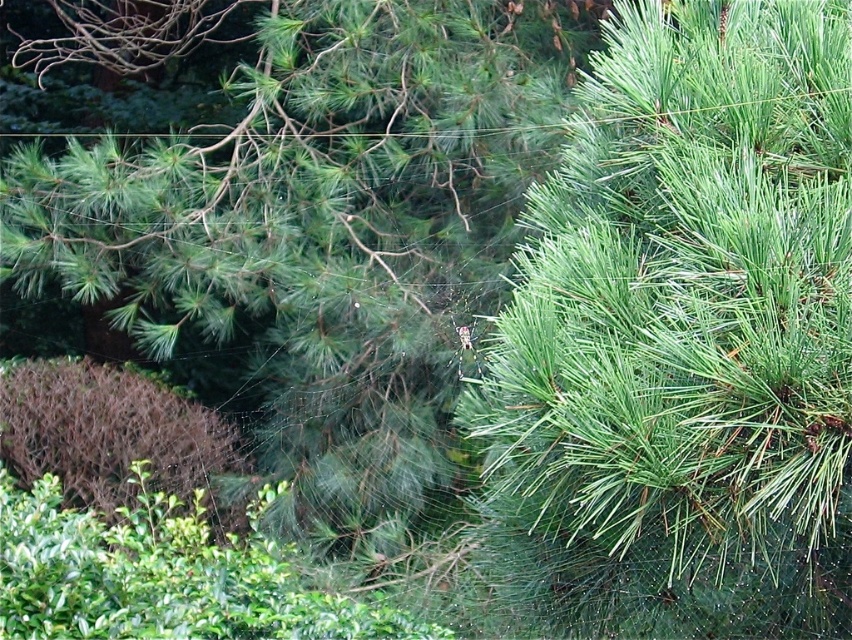
You are standing in a garden and see the green leafy bush at lower left and the brown textured bush at lower left. Which one is positioned more to the left side?

The brown textured bush at lower left is positioned more to the left side because the green leafy bush at lower left is to the right of it.